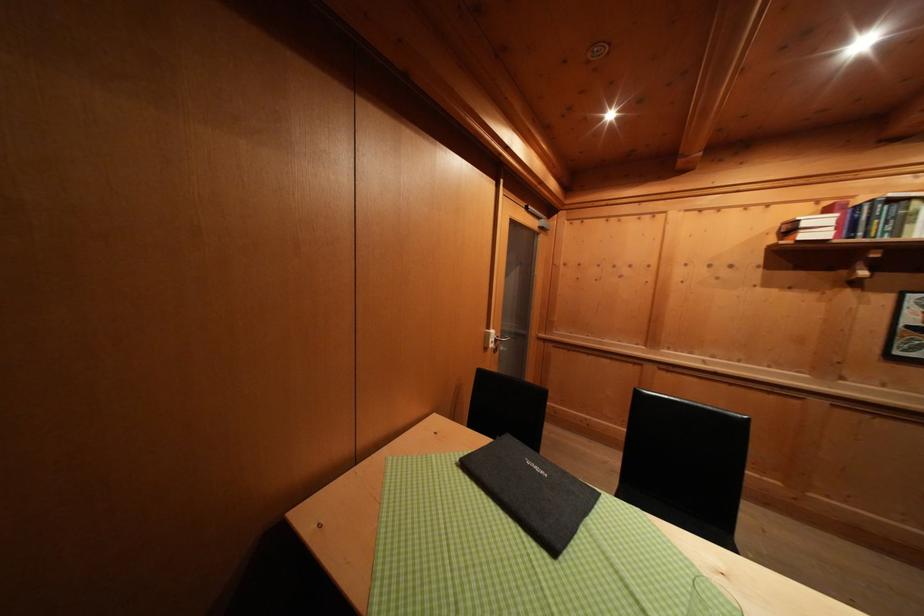
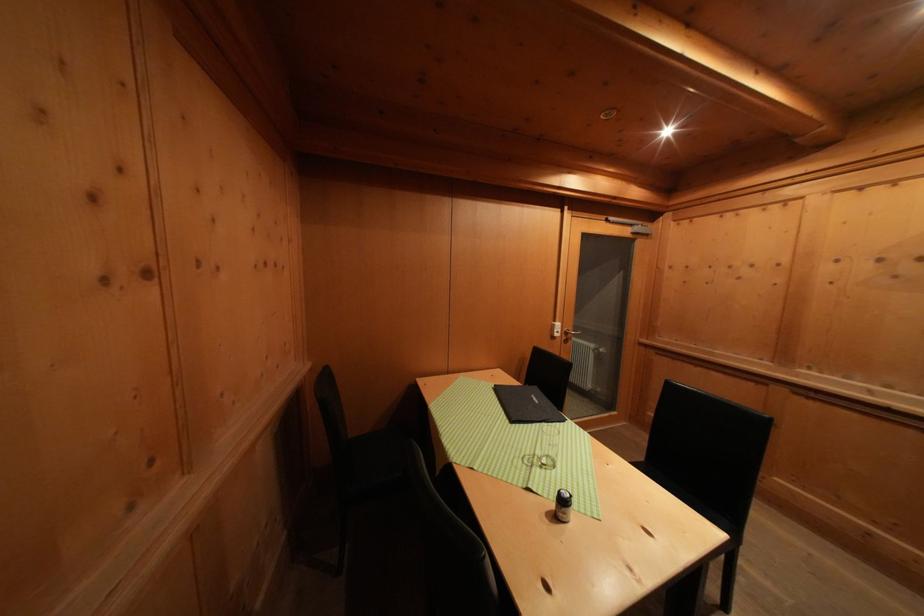
Find the pixel in the second image that matches point (589, 533) in the first image.

(543, 429)